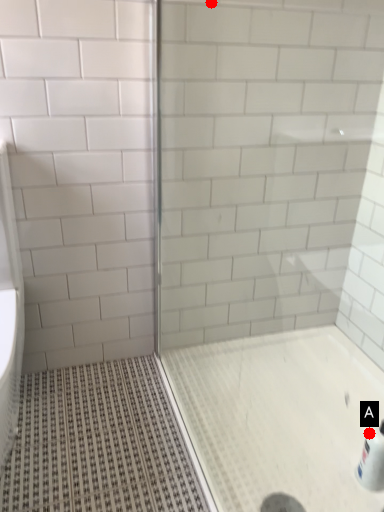
Question: Two points are circled on the image, labeled by A and B beside each circle. Which point appears closest to the camera in this image?

Choices:
 (A) A is closer
 (B) B is closer

Answer: (B)